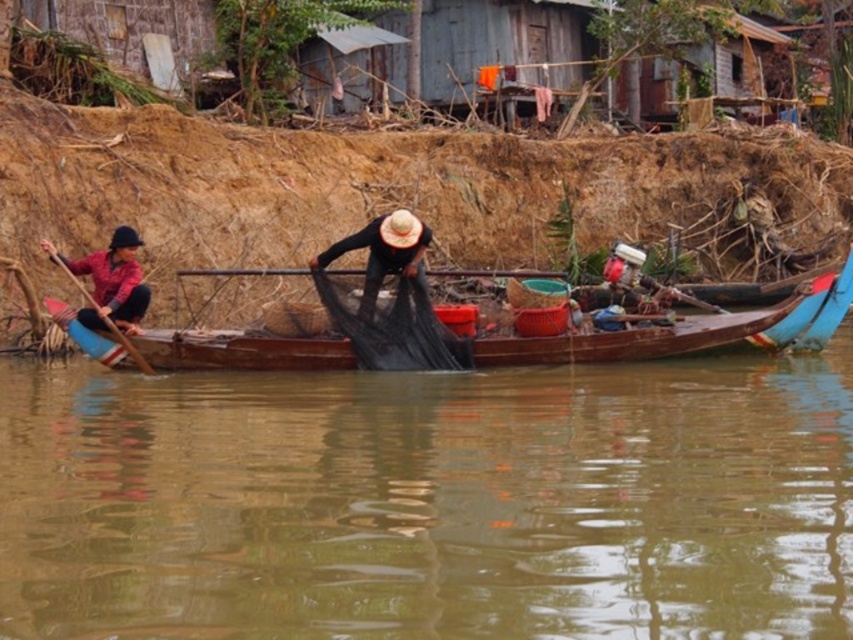
Question: Can you confirm if brown matte water at center is positioned below wooden paddle at left?

Choices:
 (A) yes
 (B) no

Answer: (A)

Question: Which of the following is the closest to the observer?

Choices:
 (A) dark brown woven hat at center
 (B) brown wooden boat at center

Answer: (B)

Question: Is black mesh net at center wider than wooden paddle at left?

Choices:
 (A) no
 (B) yes

Answer: (B)

Question: Which object appears farthest from the camera in this image?

Choices:
 (A) brown matte water at center
 (B) dark brown woven hat at center
 (C) black mesh net at center
 (D) brown wooden boat at center

Answer: (B)

Question: Does brown matte water at center appear under black mesh net at center?

Choices:
 (A) yes
 (B) no

Answer: (A)

Question: Which object is closer to the camera taking this photo?

Choices:
 (A) wooden paddle at left
 (B) brown wooden boat at center
 (C) black mesh net at center

Answer: (B)